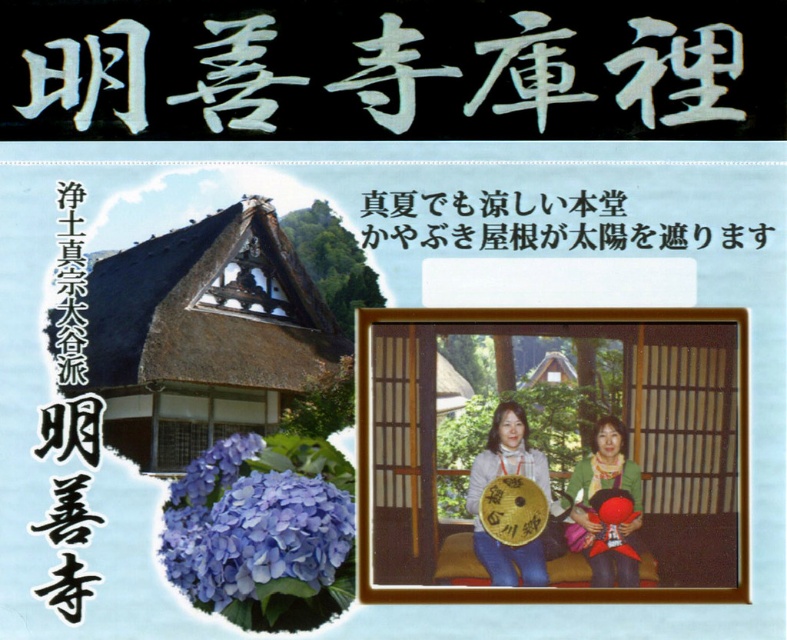
You are designing a poster and need to place a new element between the white paper at upper center and the green fabric jacket at center. Based on their sizes, which object should the new element be placed closer to?

The white paper at upper center is larger in size than the green fabric jacket at center, so the new element should be placed closer to the green fabric jacket at center to maintain visual balance.

You are standing in front of the poster for Makisenji Kuri and notice two points marked on the image. The first point is at coordinates point (305, 465) and the second is at point (499, 586). Which point is closer to you?

Point (305, 465) is closer to the camera than point (499, 586).